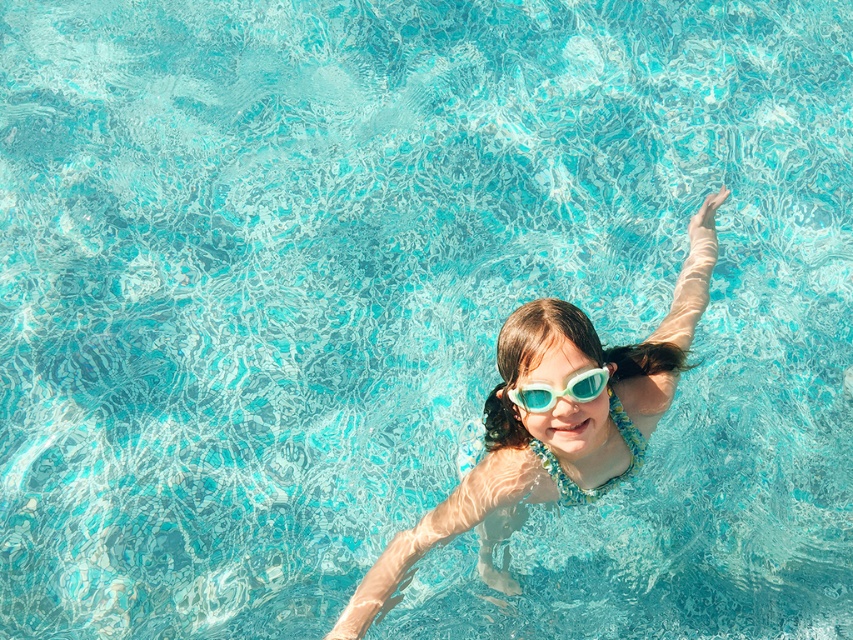
You are a lifeguard and need to determine which goggles are more suitable for a swimmer who prefers a darker lens to reduce glare. Based on the image, which goggles are more likely to be darker between the translucent plastic goggles at center and the clear plastic goggles at center?

The translucent plastic goggles at center are much taller than clear plastic goggles at center, but the description does not mention lens darkness. Both are plastic, but the clear ones are likely lighter. However, since the question is about lens darkness, the answer cannot be determined from the given information.

You are a lifeguard observing the pool. You notice two pairs of goggles at the center of the pool. Which pair of goggles is closer to you, the translucent plastic goggles at center or the clear plastic goggles at center?

The translucent plastic goggles at center are closer to you because the clear plastic goggles at center is behind them.